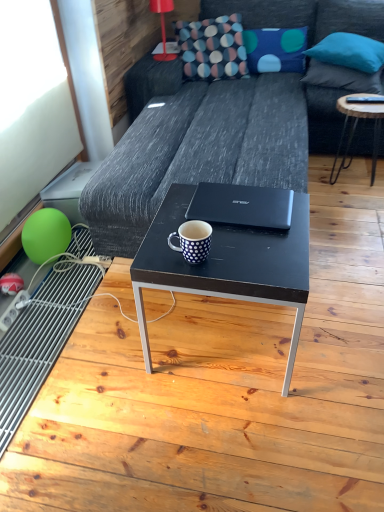
Locate an element on the screen. vacant space that is in between white dotted mug at center and black matte laptop at center is located at coordinates (238, 241).